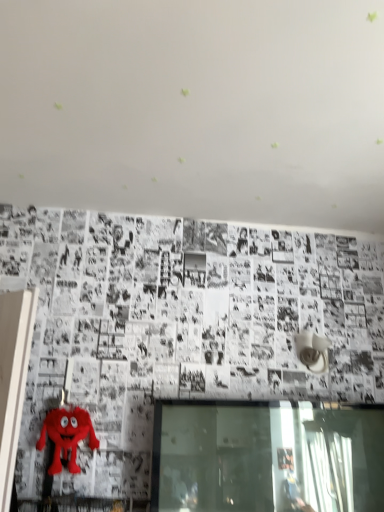
Locate an element on the screen. The width and height of the screenshot is (384, 512). transparent glass window at lower center is located at coordinates (266, 458).

Describe the element at coordinates (266, 458) in the screenshot. I see `transparent glass window at lower center` at that location.

Describe the element at coordinates (66, 437) in the screenshot. I see `fuzzy red plush toy at lower left` at that location.

You are a GUI agent. You are given a task and a screenshot of the screen. Output one action in this format:
    pyautogui.click(x=<x>, y=<y>)
    Task: Click on the fuzzy red plush toy at lower left
    
    Given the screenshot: What is the action you would take?
    pyautogui.click(x=66, y=437)

Measure the distance between point (70, 459) and camera.

Point (70, 459) and camera are 1.64 meters apart.

Locate an element on the screen. transparent glass window at lower center is located at coordinates (266, 458).

Which object is positioned more to the left, fuzzy red plush toy at lower left or transparent glass window at lower center?

fuzzy red plush toy at lower left is more to the left.

Which is behind, fuzzy red plush toy at lower left or transparent glass window at lower center?

Positioned behind is fuzzy red plush toy at lower left.

Does point (53, 471) come closer to viewer compared to point (315, 508)?

No, it is behind (315, 508).

From the image's perspective, who appears lower, fuzzy red plush toy at lower left or transparent glass window at lower center?

transparent glass window at lower center, from the image's perspective.

From a real-world perspective, is fuzzy red plush toy at lower left physically below transparent glass window at lower center?

Actually, fuzzy red plush toy at lower left is physically above transparent glass window at lower center in the real world.

Does fuzzy red plush toy at lower left have a greater width compared to transparent glass window at lower center?

No.

Between fuzzy red plush toy at lower left and transparent glass window at lower center, which one has less height?

fuzzy red plush toy at lower left.

Does fuzzy red plush toy at lower left have a smaller size compared to transparent glass window at lower center?

Yes.

Could transparent glass window at lower center be considered to be inside fuzzy red plush toy at lower left?

Actually, transparent glass window at lower center is outside fuzzy red plush toy at lower left.

Can you see fuzzy red plush toy at lower left touching transparent glass window at lower center?

No, fuzzy red plush toy at lower left is not with transparent glass window at lower center.

Is fuzzy red plush toy at lower left turned away from transparent glass window at lower center?

That's not correct — fuzzy red plush toy at lower left is not looking away from transparent glass window at lower center.

How many degrees apart are the facing directions of fuzzy red plush toy at lower left and transparent glass window at lower center?

The angle between the facing direction of fuzzy red plush toy at lower left and the facing direction of transparent glass window at lower center is 2.04 degrees.

Locate an element on the screen. This screenshot has height=512, width=384. window that is below the fuzzy red plush toy at lower left (from the image's perspective) is located at coordinates (266, 458).

Is transparent glass window at lower center to the right of fuzzy red plush toy at lower left from the viewer's perspective?

Yes, transparent glass window at lower center is to the right of fuzzy red plush toy at lower left.

Looking at this image, considering the positions of objects transparent glass window at lower center and fuzzy red plush toy at lower left in the image provided, who is in front, transparent glass window at lower center or fuzzy red plush toy at lower left?

transparent glass window at lower center is in front.

Is point (179, 407) closer or farther from the camera than point (57, 444)?

Point (179, 407) is positioned farther from the camera compared to point (57, 444).

From the image's perspective, is transparent glass window at lower center above fuzzy red plush toy at lower left?

No.

From a real-world perspective, is transparent glass window at lower center under fuzzy red plush toy at lower left?

Yes, from a real-world perspective, transparent glass window at lower center is under fuzzy red plush toy at lower left.

Which object is thinner, transparent glass window at lower center or fuzzy red plush toy at lower left?

fuzzy red plush toy at lower left.

Which of these two, transparent glass window at lower center or fuzzy red plush toy at lower left, stands taller?

With more height is transparent glass window at lower center.

Which of these two, transparent glass window at lower center or fuzzy red plush toy at lower left, is bigger?

Bigger between the two is transparent glass window at lower center.

Is fuzzy red plush toy at lower left inside transparent glass window at lower center?

That's incorrect, fuzzy red plush toy at lower left is not inside transparent glass window at lower center.

Is transparent glass window at lower center not close to fuzzy red plush toy at lower left?

transparent glass window at lower center is actually quite close to fuzzy red plush toy at lower left.

Is transparent glass window at lower center aimed at fuzzy red plush toy at lower left?

No, transparent glass window at lower center is not turned towards fuzzy red plush toy at lower left.

How far apart are transparent glass window at lower center and fuzzy red plush toy at lower left?

They are 23.36 inches apart.

The width and height of the screenshot is (384, 512). I want to click on toy lying behind the transparent glass window at lower center, so click(66, 437).

Image resolution: width=384 pixels, height=512 pixels. I want to click on toy to the left of transparent glass window at lower center, so click(x=66, y=437).

At what (x,y) coordinates should I click in order to perform the action: click on window located underneath the fuzzy red plush toy at lower left (from a real-world perspective). Please return your answer as a coordinate pair (x, y). The height and width of the screenshot is (512, 384). Looking at the image, I should click on (266, 458).